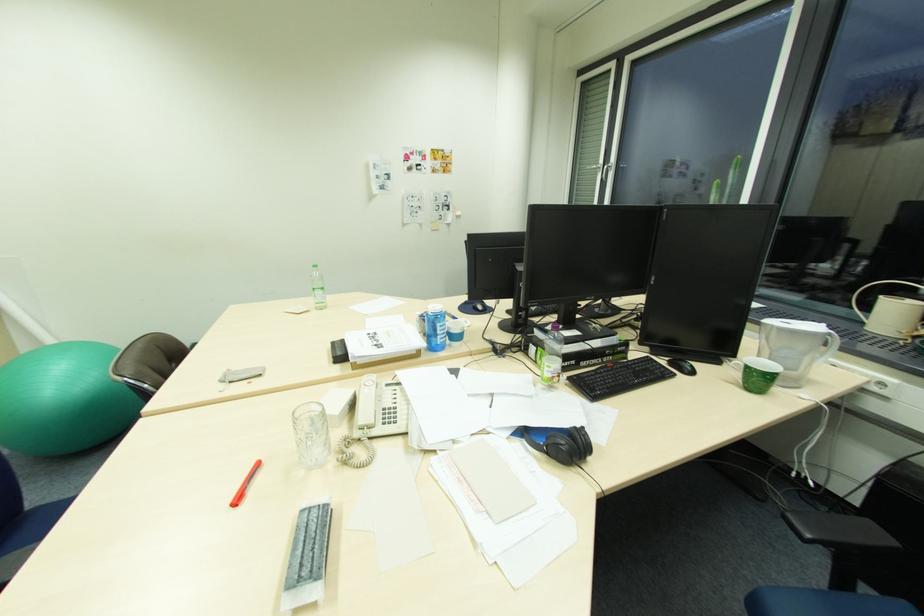
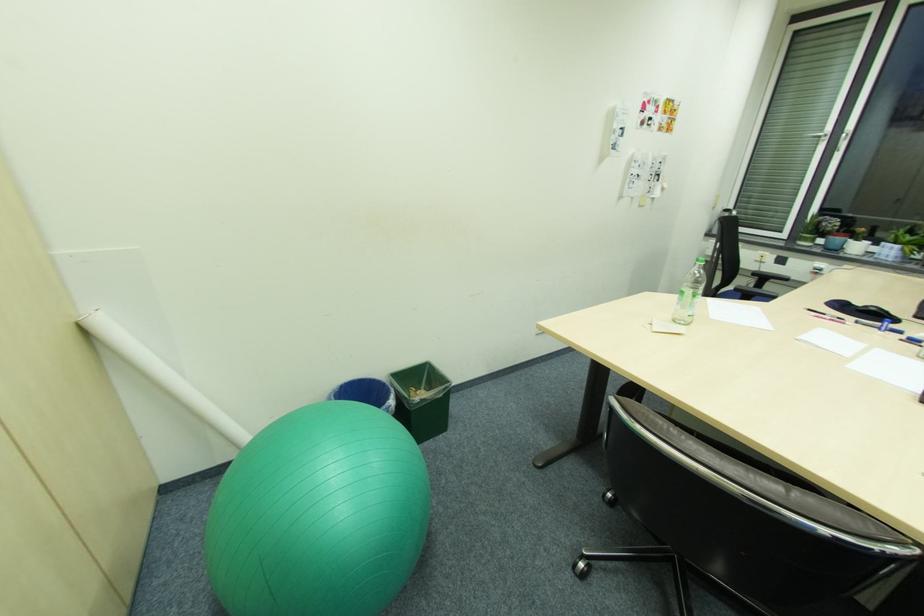
The point at (592, 168) is marked in the first image. Where is the corresponding point in the second image?

(812, 136)